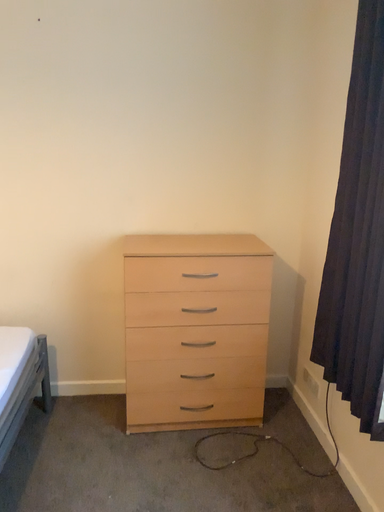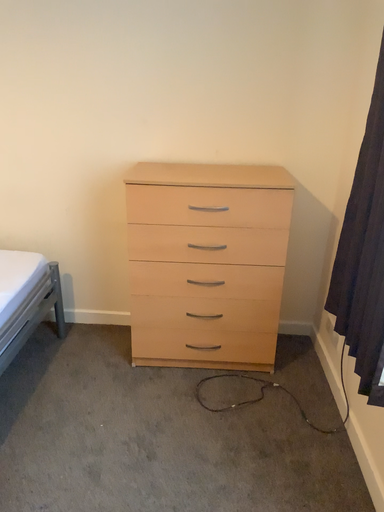
Question: How did the camera likely rotate when shooting the video?

Choices:
 (A) rotated left
 (B) rotated right

Answer: (A)